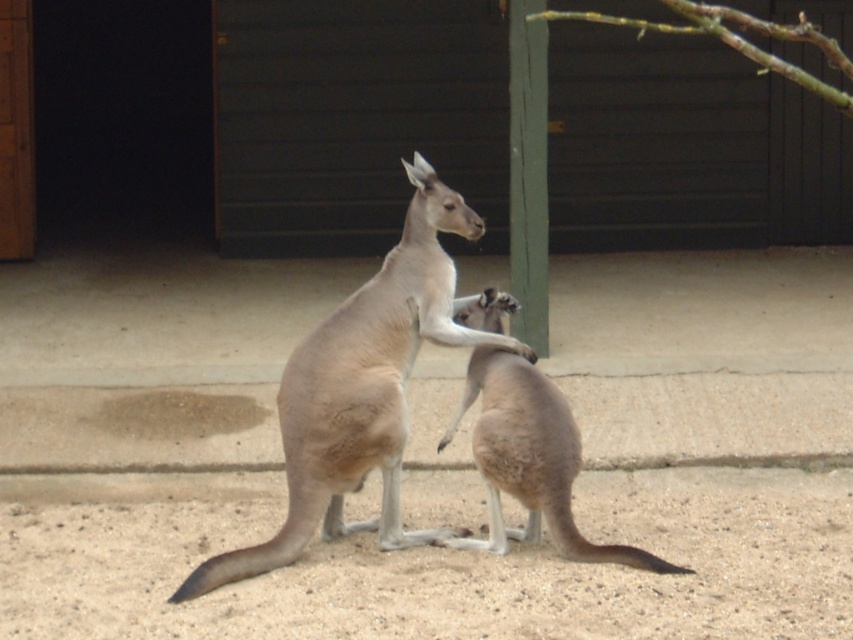
Between light brown fur kangaroo at center and light brown fur at center, which one appears on the right side from the viewer's perspective?

From the viewer's perspective, light brown fur at center appears more on the right side.

Where is `light brown fur kangaroo at center`? light brown fur kangaroo at center is located at coordinates (363, 388).

From the picture: Who is more forward, (444, 252) or (474, 545)?

Point (474, 545) is in front.

The width and height of the screenshot is (853, 640). I want to click on light brown fur kangaroo at center, so click(x=363, y=388).

The width and height of the screenshot is (853, 640). What do you see at coordinates (531, 460) in the screenshot?
I see `light brown fur at center` at bounding box center [531, 460].

Is light brown fur at center closer to camera compared to green wood pole at center?

Yes, light brown fur at center is in front of green wood pole at center.

Which is behind, point (527, 534) or point (520, 76)?

Positioned behind is point (520, 76).

Identify the location of light brown fur at center. The height and width of the screenshot is (640, 853). coord(531,460).

Is light brown fur kangaroo at center thinner than green wood pole at center?

No, light brown fur kangaroo at center is not thinner than green wood pole at center.

Can you confirm if light brown fur kangaroo at center is positioned to the right of green wood pole at center?

In fact, light brown fur kangaroo at center is to the left of green wood pole at center.

Locate an element on the screen. The image size is (853, 640). light brown fur kangaroo at center is located at coordinates (363, 388).